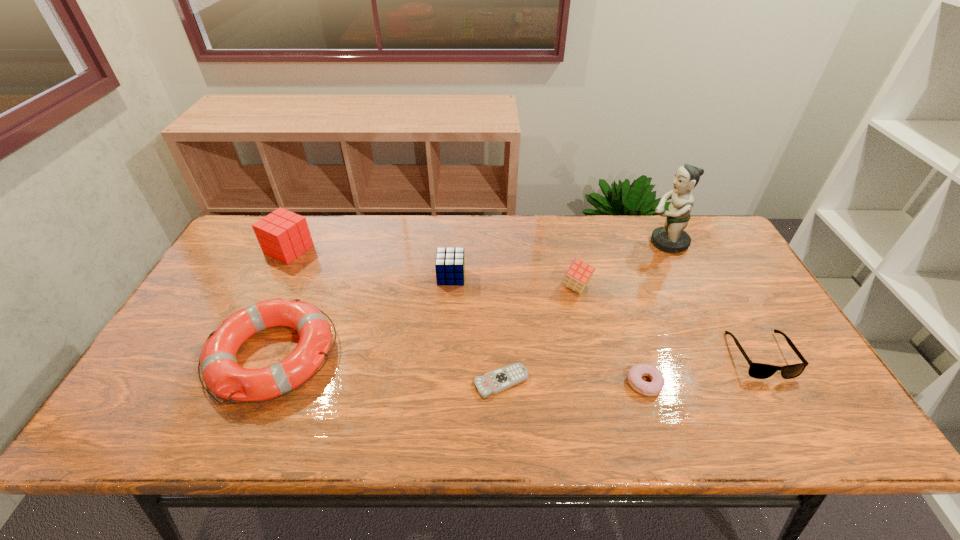
The height and width of the screenshot is (540, 960). What are the coordinates of `object that is at the far right corner` in the screenshot? It's located at (672, 238).

In order to click on free space at the far edge of the desktop in this screenshot , I will do `click(486, 240)`.

You are a GUI agent. You are given a task and a screenshot of the screen. Output one action in this format:
    pyautogui.click(x=<x>, y=<y>)
    Task: Click on the vacant space at the near edge of the desktop
    This screenshot has height=540, width=960.
    Given the screenshot: What is the action you would take?
    pyautogui.click(x=265, y=438)

Find the location of a particular element. blank space at the left edge of the desktop is located at coordinates (259, 268).

Identify the location of vacant space at the right edge. The width and height of the screenshot is (960, 540). (756, 305).

At what (x,y) coordinates should I click in order to perform the action: click on vacant point at the far left corner. Please return your answer as a coordinate pair (x, y). The height and width of the screenshot is (540, 960). Looking at the image, I should click on (238, 247).

Where is `vacant region at the near left corner of the desktop`? vacant region at the near left corner of the desktop is located at coordinates (131, 430).

Where is `free space at the far right corner`? Image resolution: width=960 pixels, height=540 pixels. free space at the far right corner is located at coordinates (714, 223).

Identify the location of vacant point located between the third object from right to left and the life buoy. (459, 369).

Identify the location of free space that is in between the remote control and the sixth object from left to right. (573, 382).